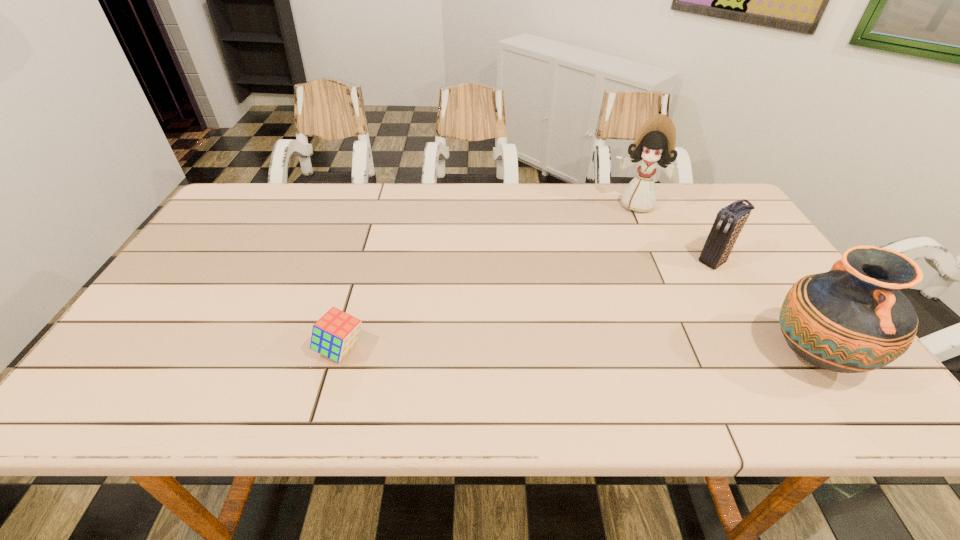
This screenshot has height=540, width=960. I want to click on vacant space that's between the pottery and the third tallest object, so click(764, 308).

Identify the location of free space that is in between the cube and the pottery. The width and height of the screenshot is (960, 540). (577, 353).

Identify the location of empty space between the cube and the clutch bag. This screenshot has width=960, height=540. (528, 305).

You are a GUI agent. You are given a task and a screenshot of the screen. Output one action in this format:
    pyautogui.click(x=<x>, y=<y>)
    Task: Click on the free space that is in between the third nearest object and the leftmost object
    
    Given the screenshot: What is the action you would take?
    [528, 305]

Locate an element on the screen. The width and height of the screenshot is (960, 540). the third closest object to the doll is located at coordinates (336, 332).

You are a GUI agent. You are given a task and a screenshot of the screen. Output one action in this format:
    pyautogui.click(x=<x>, y=<y>)
    Task: Click on the object that is the closest to the cube
    The width and height of the screenshot is (960, 540).
    Given the screenshot: What is the action you would take?
    (654, 146)

The height and width of the screenshot is (540, 960). In order to click on blank space that satisfies the following two spatial constraints: 1. on the front side of the pottery; 2. on the left side of the leftmost object in this screenshot , I will do `click(339, 356)`.

Image resolution: width=960 pixels, height=540 pixels. Identify the location of free region that satisfies the following two spatial constraints: 1. on the back side of the third nearest object; 2. on the right side of the shortest object. (366, 261).

Identify the location of free location that satisfies the following two spatial constraints: 1. on the front side of the pottery; 2. on the left side of the third tallest object. The width and height of the screenshot is (960, 540). (771, 356).